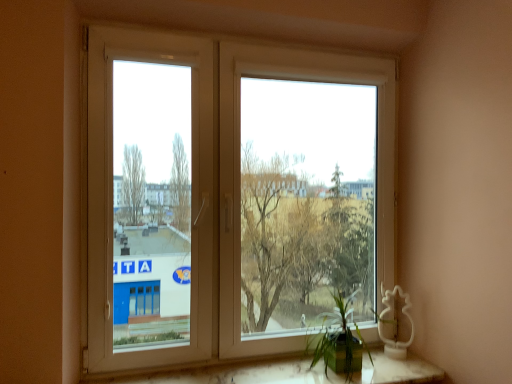
Question: Does green matte plant at lower right appear on the left side of white plastic window at center?

Choices:
 (A) no
 (B) yes

Answer: (A)

Question: Considering the relative sizes of green matte plant at lower right and white plastic window at center in the image provided, is green matte plant at lower right smaller than white plastic window at center?

Choices:
 (A) yes
 (B) no

Answer: (A)

Question: Is green matte plant at lower right touching white plastic window at center?

Choices:
 (A) no
 (B) yes

Answer: (A)

Question: From a real-world perspective, is green matte plant at lower right physically above white plastic window at center?

Choices:
 (A) no
 (B) yes

Answer: (A)

Question: Can you confirm if green matte plant at lower right is bigger than white plastic window at center?

Choices:
 (A) no
 (B) yes

Answer: (A)

Question: From the image's perspective, is white marble window sill at lower center positioned above or below white plastic window at center?

Choices:
 (A) below
 (B) above

Answer: (A)

Question: From a real-world perspective, relative to white plastic window at center, is white marble window sill at lower center vertically above or below?

Choices:
 (A) above
 (B) below

Answer: (B)

Question: Is point (237, 365) positioned closer to the camera than point (177, 76)?

Choices:
 (A) closer
 (B) farther

Answer: (A)

Question: Considering the positions of white marble window sill at lower center and white plastic window at center in the image, is white marble window sill at lower center taller or shorter than white plastic window at center?

Choices:
 (A) tall
 (B) short

Answer: (B)

Question: In terms of height, does white plastic window at left look taller or shorter compared to white plastic window at center?

Choices:
 (A) tall
 (B) short

Answer: (B)

Question: Is white plastic window at left in front of or behind white plastic window at center in the image?

Choices:
 (A) behind
 (B) front

Answer: (B)

Question: From the image's perspective, is white plastic window at left positioned above or below white plastic window at center?

Choices:
 (A) above
 (B) below

Answer: (A)

Question: Considering the positions of white plastic window at left and white plastic window at center in the image, is white plastic window at left wider or thinner than white plastic window at center?

Choices:
 (A) thin
 (B) wide

Answer: (A)

Question: In the image, is white marble window sill at lower center positioned in front of or behind white plastic window at left?

Choices:
 (A) behind
 (B) front

Answer: (B)

Question: From their relative heights in the image, would you say white marble window sill at lower center is taller or shorter than white plastic window at left?

Choices:
 (A) tall
 (B) short

Answer: (B)